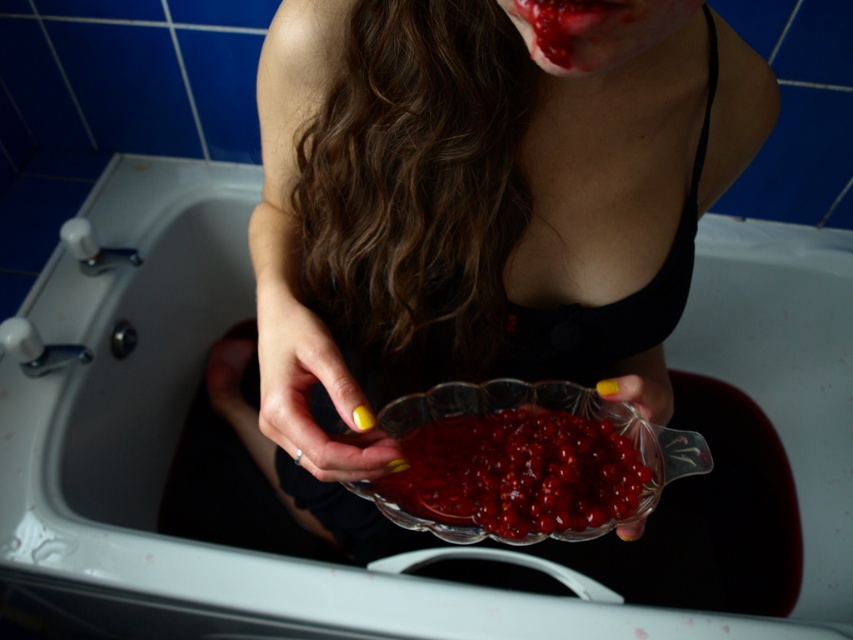
Question: Can you confirm if yellow matte nail polish at center is positioned below glossy plastic mouth at upper center?

Choices:
 (A) yes
 (B) no

Answer: (A)

Question: Estimate the real-world distances between objects in this image. Which object is closer to the yellow matte nail polish at center?

Choices:
 (A) glossy plastic face at upper center
 (B) glossy plastic mouth at upper center

Answer: (A)

Question: Which point is farther to the camera?

Choices:
 (A) yellow matte nail polish at center
 (B) glossy glass bowl at center
 (C) transparent glass bowl at center
 (D) glossy plastic mouth at upper center

Answer: (B)

Question: In this image, where is transparent glass bowl at center located relative to glossy plastic face at upper center?

Choices:
 (A) left
 (B) right

Answer: (A)

Question: Can you confirm if yellow matte nail polish at center is smaller than glossy plastic mouth at upper center?

Choices:
 (A) yes
 (B) no

Answer: (B)

Question: Considering the real-world distances, which object is farthest from the glossy glass bowl at center?

Choices:
 (A) transparent glass bowl at center
 (B) glossy plastic face at upper center

Answer: (B)